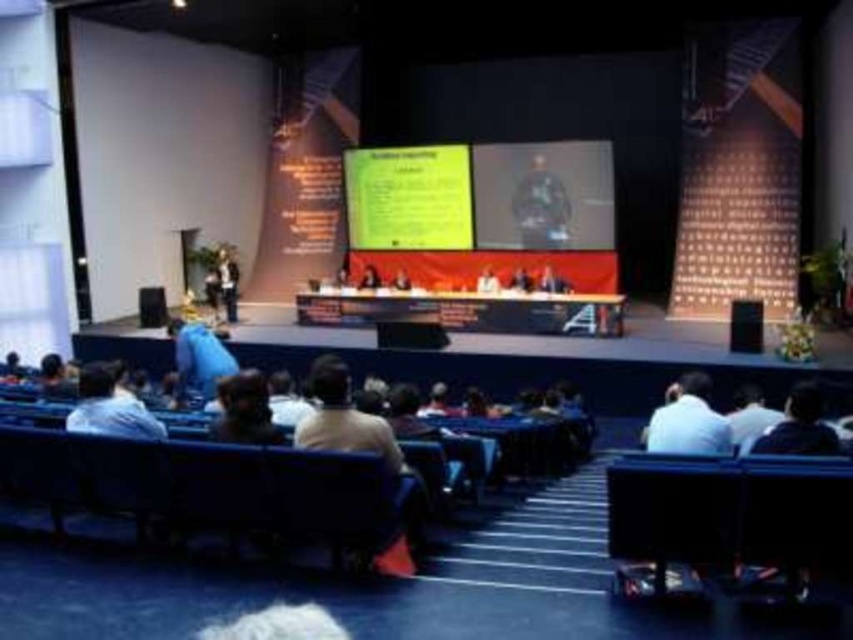
You are a GUI agent. You are given a task and a screenshot of the screen. Output one action in this format:
    pyautogui.click(x=<x>, y=<y>)
    Task: Click on the yellow paper at upper center
    
    Given the screenshot: What is the action you would take?
    pyautogui.click(x=408, y=196)

From the picture: Does yellow paper at upper center appear on the right side of smooth skin person at center?

Yes, yellow paper at upper center is to the right of smooth skin person at center.

Where is `yellow paper at upper center`? This screenshot has width=853, height=640. yellow paper at upper center is located at coordinates (408, 196).

Between point (456, 163) and point (657, 413), which one is positioned behind?

Positioned behind is point (456, 163).

Is yellow paper at upper center to the left of white fabric shirt at lower right from the viewer's perspective?

Indeed, yellow paper at upper center is positioned on the left side of white fabric shirt at lower right.

Does point (390, 173) come behind point (647, 435)?

Yes, it is behind point (647, 435).

You are a GUI agent. You are given a task and a screenshot of the screen. Output one action in this format:
    pyautogui.click(x=<x>, y=<y>)
    Task: Click on the yellow paper at upper center
    
    Given the screenshot: What is the action you would take?
    pyautogui.click(x=408, y=196)

Does point (402, 148) come in front of point (799, 436)?

That is False.

The width and height of the screenshot is (853, 640). I want to click on yellow paper at upper center, so click(x=408, y=196).

Identify the location of yellow paper at upper center. Image resolution: width=853 pixels, height=640 pixels. (408, 196).